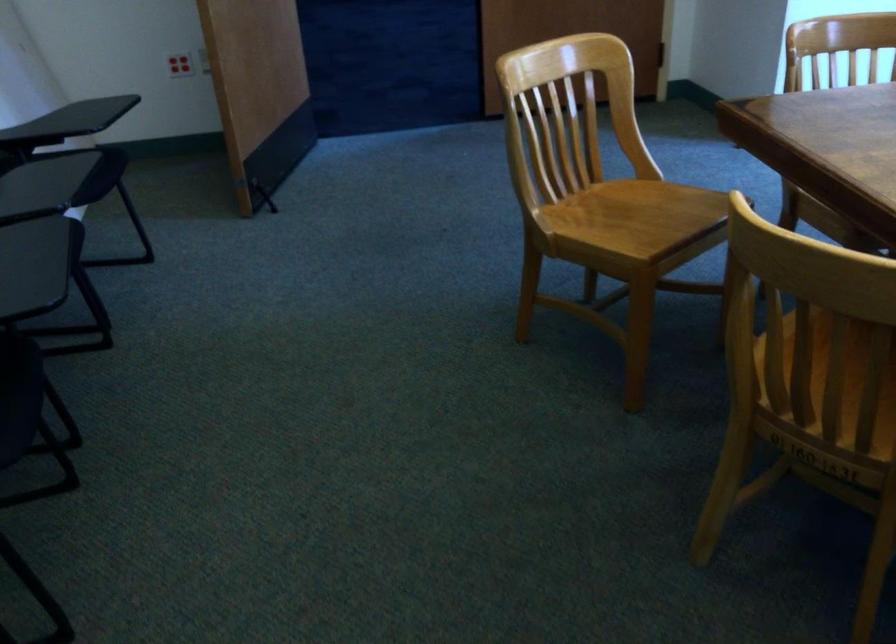
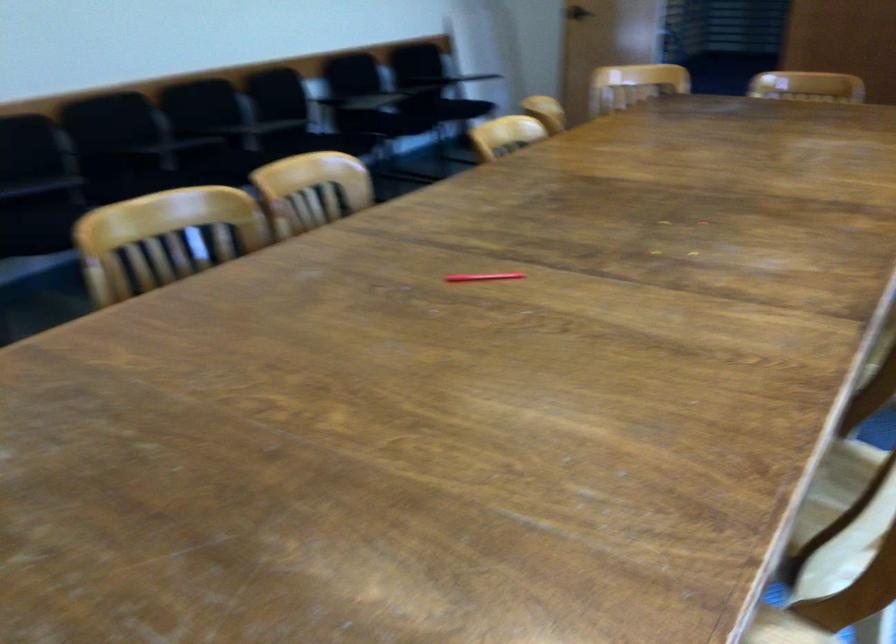
Question: I am providing you with two images of the same scene from different viewpoints. Please identify which objects are invisible in image2.

Choices:
 (A) red pen
 (B) black chair sitting surface
 (C) Toblerone box
 (D) wooden chair sitting surface

Answer: (D)